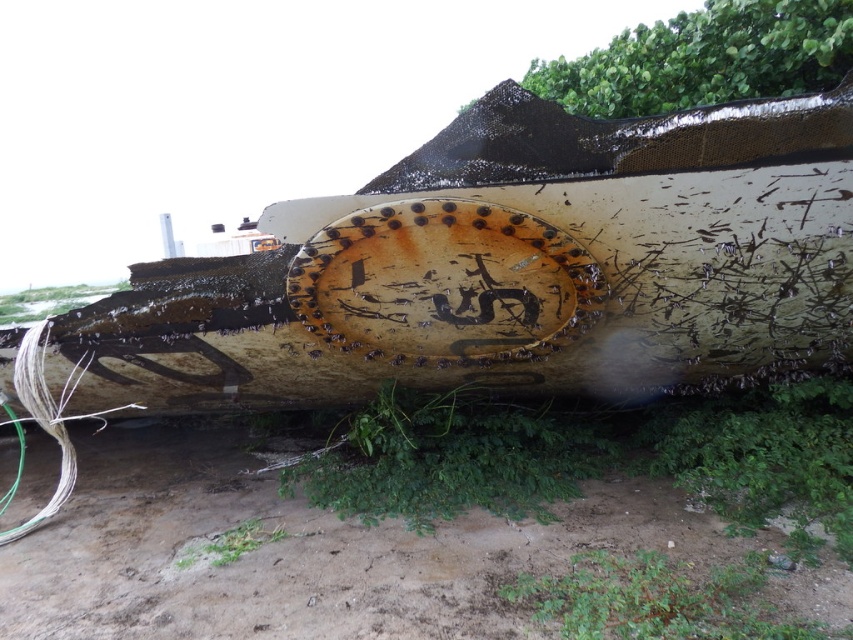
Question: Where is rusty metal boat at center located in relation to dull brown dirt track at lower center in the image?

Choices:
 (A) below
 (B) above

Answer: (B)

Question: Which point is farther from the camera taking this photo?

Choices:
 (A) (349, 230)
 (B) (581, 520)

Answer: (B)

Question: In this image, where is rusty metal boat at center located relative to dull brown dirt track at lower center?

Choices:
 (A) right
 (B) left

Answer: (A)

Question: Can you confirm if rusty metal boat at center is positioned to the right of dull brown dirt track at lower center?

Choices:
 (A) yes
 (B) no

Answer: (A)

Question: Which object is farther from the camera taking this photo?

Choices:
 (A) dull brown dirt track at lower center
 (B) rusty metal boat at center

Answer: (B)

Question: Which point is farther to the camera?

Choices:
 (A) (653, 340)
 (B) (41, 556)

Answer: (A)